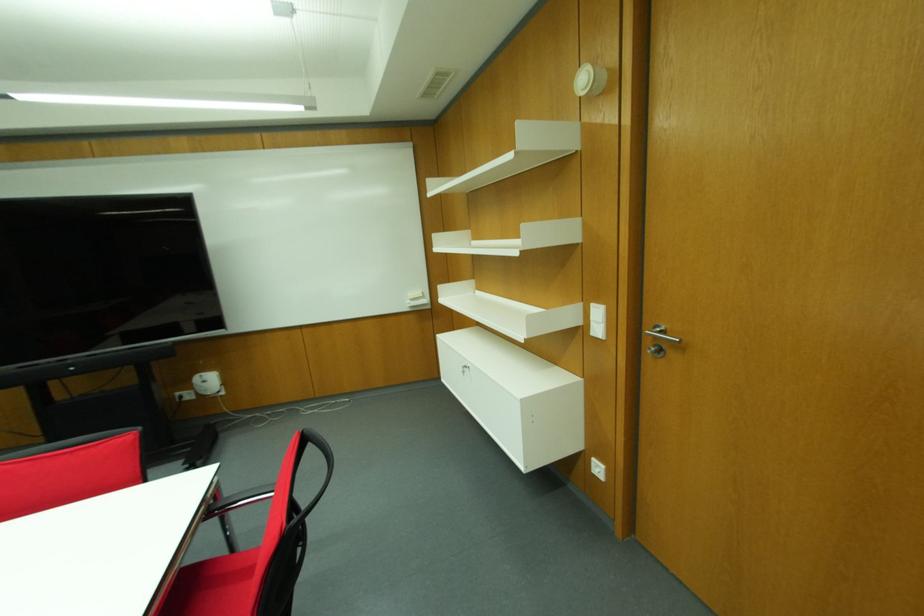
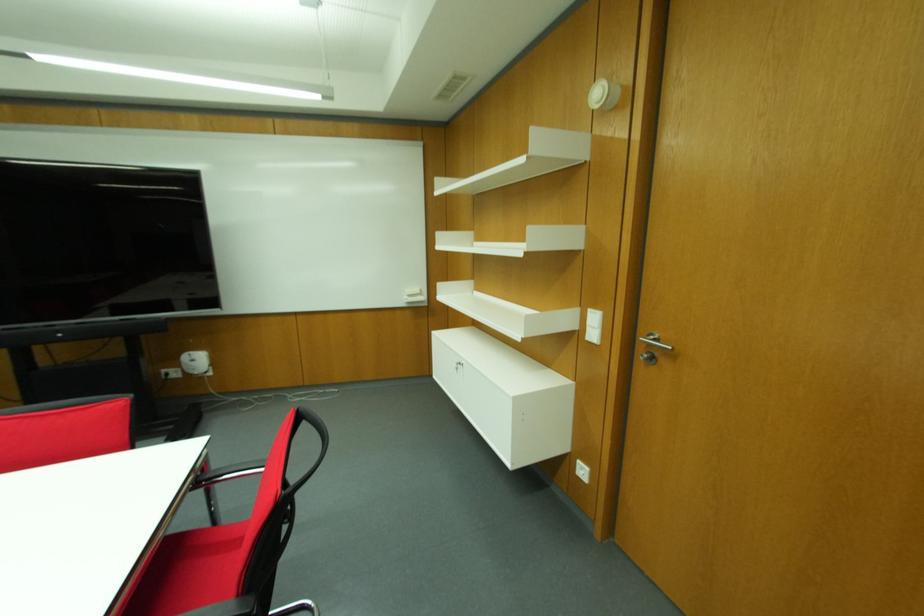
In the second image, find the point that corresponds to point 593,459 in the first image.

(578, 463)